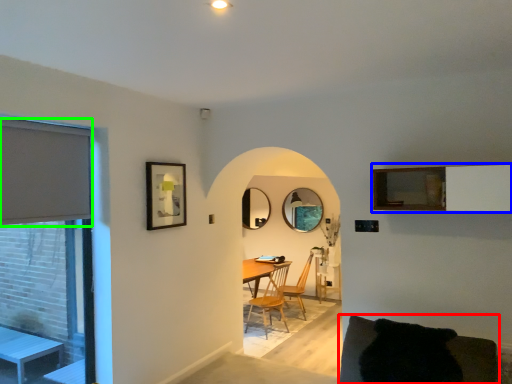
Question: Considering the real-world distances, which object is closest to couch (highlighted by a red box)? balcony (highlighted by a blue box) or window screen (highlighted by a green box).

Choices:
 (A) balcony
 (B) window screen

Answer: (A)